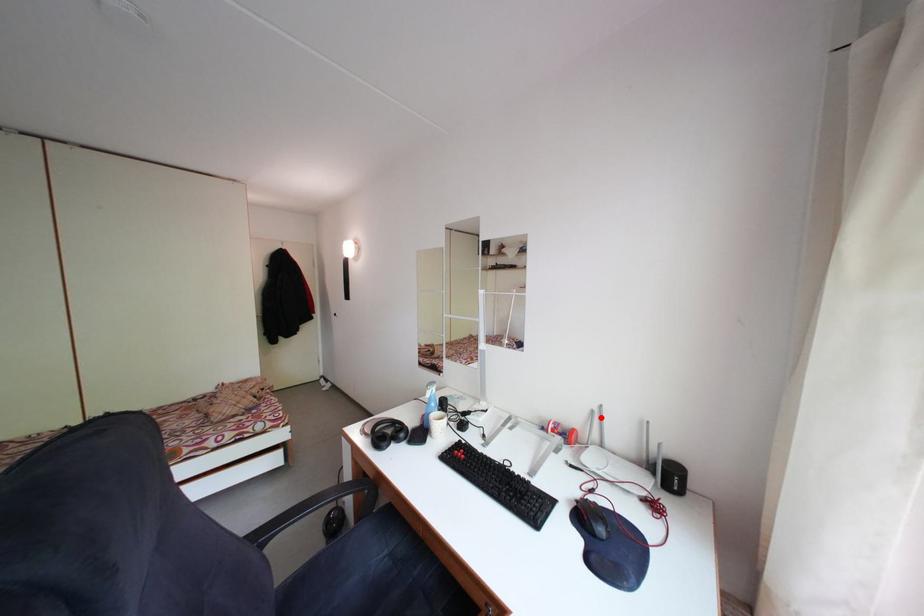
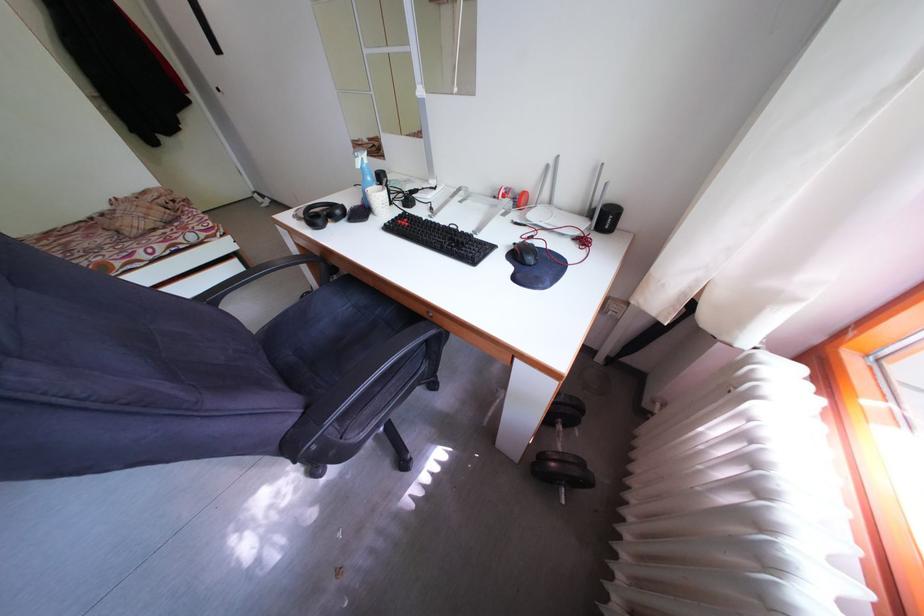
Question: I am providing you with two images of the same scene from different viewpoints. In image1, a red point is highlighted. Considering the same 3D point in image2, which of the following is correct?

Choices:
 (A) It is closer
 (B) It is farther

Answer: (A)